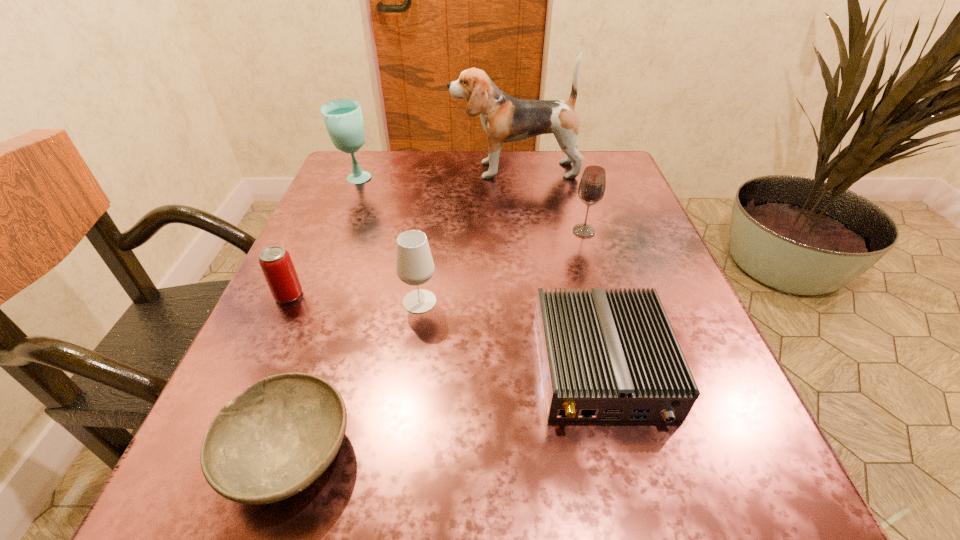
What are the coordinates of `object present at the far right corner` in the screenshot? It's located at (504, 118).

The width and height of the screenshot is (960, 540). In the image, there is a desktop. In order to click on free region at the far edge in this screenshot , I will do `click(525, 184)`.

Find the location of a particular element. Image resolution: width=960 pixels, height=540 pixels. vacant region at the near edge of the desktop is located at coordinates (508, 498).

The height and width of the screenshot is (540, 960). I want to click on vacant space at the left edge of the desktop, so click(x=346, y=235).

Find the location of a particular element. This screenshot has width=960, height=540. free space at the right edge of the desktop is located at coordinates (593, 217).

In the image, there is a desktop. Identify the location of free region at the far left corner. (374, 191).

Locate an element on the screen. This screenshot has height=540, width=960. vacant space at the far right corner of the desktop is located at coordinates (614, 177).

Where is `free space that is in between the tallest glass and the third shortest object`? This screenshot has width=960, height=540. free space that is in between the tallest glass and the third shortest object is located at coordinates (323, 238).

Locate an element on the screen. The width and height of the screenshot is (960, 540). free area in between the fourth object from left to right and the tallest object is located at coordinates (467, 236).

At what (x,y) coordinates should I click in order to perform the action: click on empty space that is in between the beer can and the third farthest object. Please return your answer as a coordinate pair (x, y). This screenshot has width=960, height=540. Looking at the image, I should click on (436, 264).